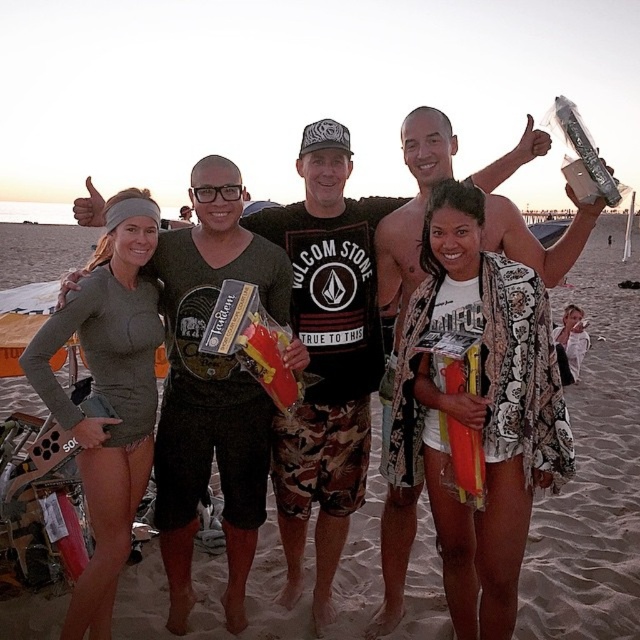
Is matte black shirt at center taller than matte black t-shirt at center?

Yes, matte black shirt at center is taller than matte black t-shirt at center.

Between point (248, 538) and point (296, 474), which one is positioned behind?

Positioned behind is point (296, 474).

At what (x,y) coordinates should I click in order to perform the action: click on matte black shirt at center. Please return your answer as a coordinate pair (x, y). Image resolution: width=640 pixels, height=640 pixels. Looking at the image, I should click on (211, 388).

Can you confirm if camouflage shorts at center is positioned to the left of matte black t-shirt at center?

No, camouflage shorts at center is not to the left of matte black t-shirt at center.

Who is positioned more to the right, camouflage shorts at center or matte black t-shirt at center?

Positioned to the right is camouflage shorts at center.

Is point (401, 540) less distant than point (314, 420)?

No.

Where is `camouflage shorts at center`? This screenshot has width=640, height=640. camouflage shorts at center is located at coordinates (412, 208).

Does matte black shirt at center have a lesser height compared to camouflage shorts at center?

No.

Which is more to the right, matte black shirt at center or camouflage shorts at center?

camouflage shorts at center is more to the right.

Is point (236, 452) positioned behind point (438, 122)?

No.

Locate an element on the screen. The width and height of the screenshot is (640, 640). matte black shirt at center is located at coordinates (211, 388).